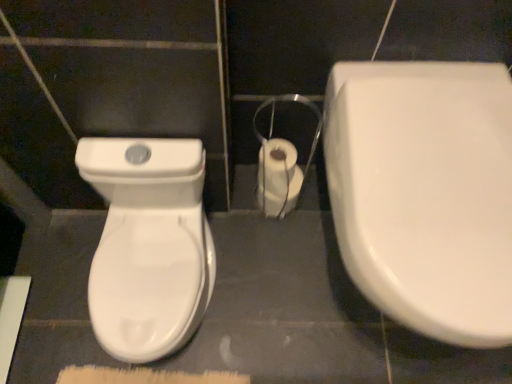
You are a GUI agent. You are given a task and a screenshot of the screen. Output one action in this format:
    pyautogui.click(x=<x>, y=<y>)
    Task: Click on the vacant area to the left of white glossy toilet at left, which ranks as the 1th toilet in left-to-right order
    The height and width of the screenshot is (384, 512).
    Given the screenshot: What is the action you would take?
    pyautogui.click(x=50, y=300)